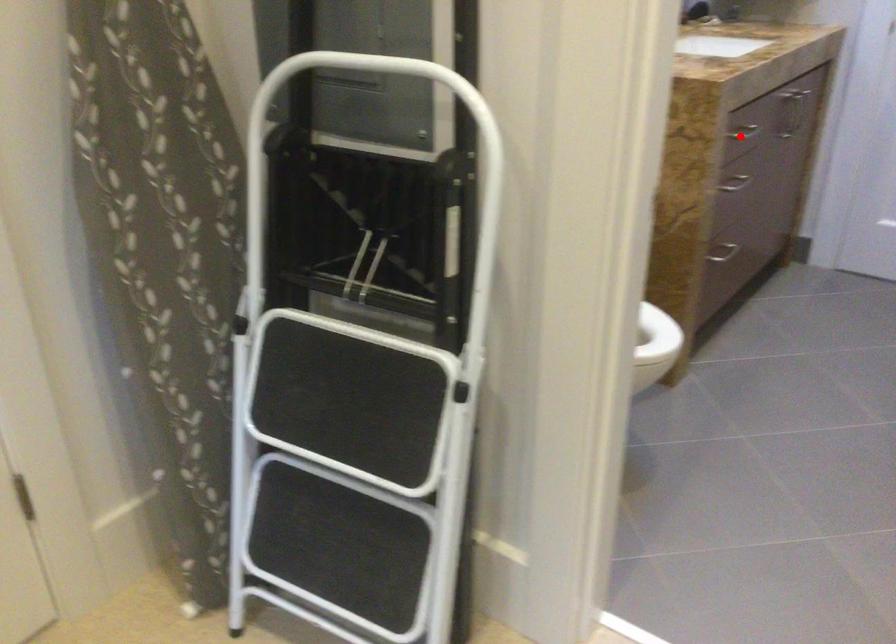
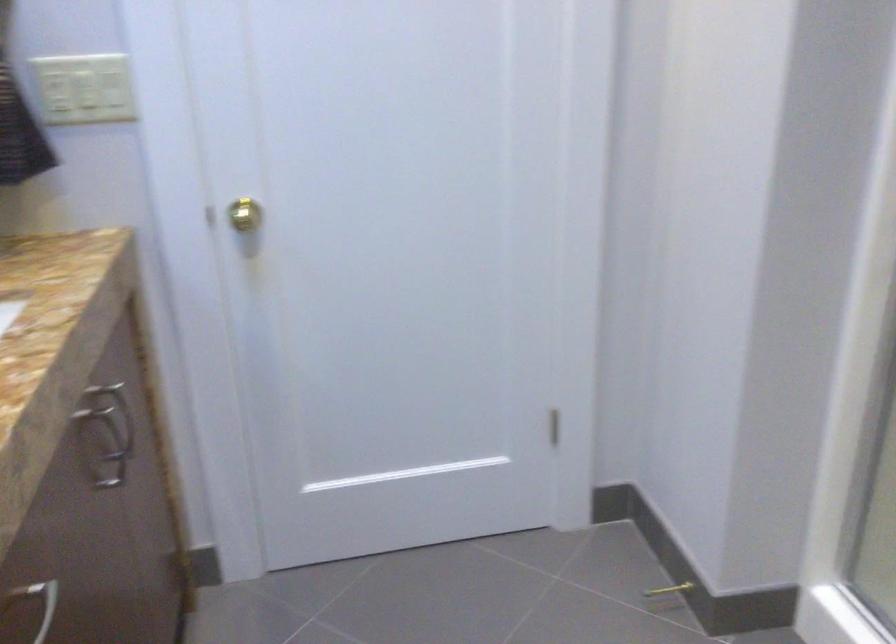
Question: I am providing you with two images of the same scene from different viewpoints. In image1, a red point is highlighted. Considering the same 3D point in image2, which of the following is correct?

Choices:
 (A) It is closer
 (B) It is farther

Answer: (A)